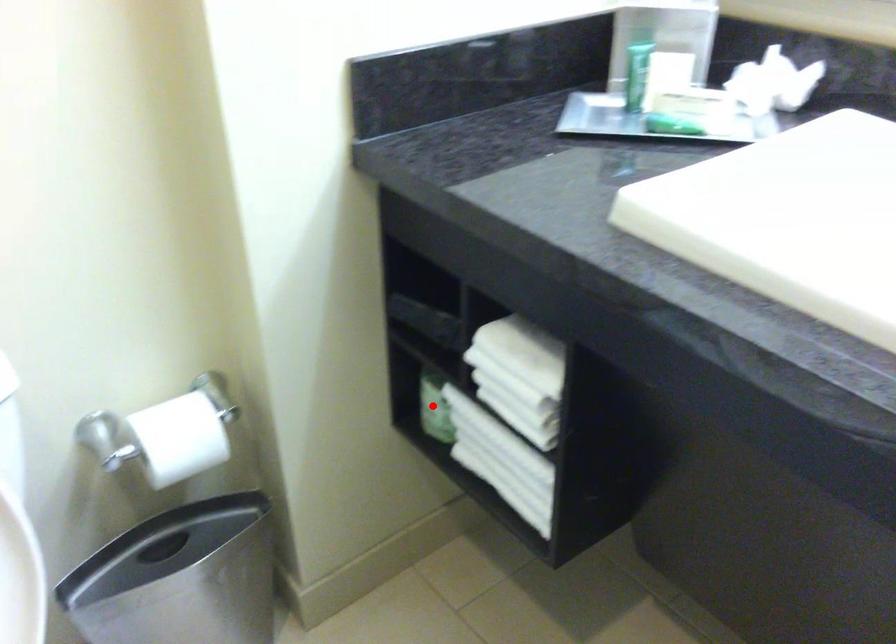
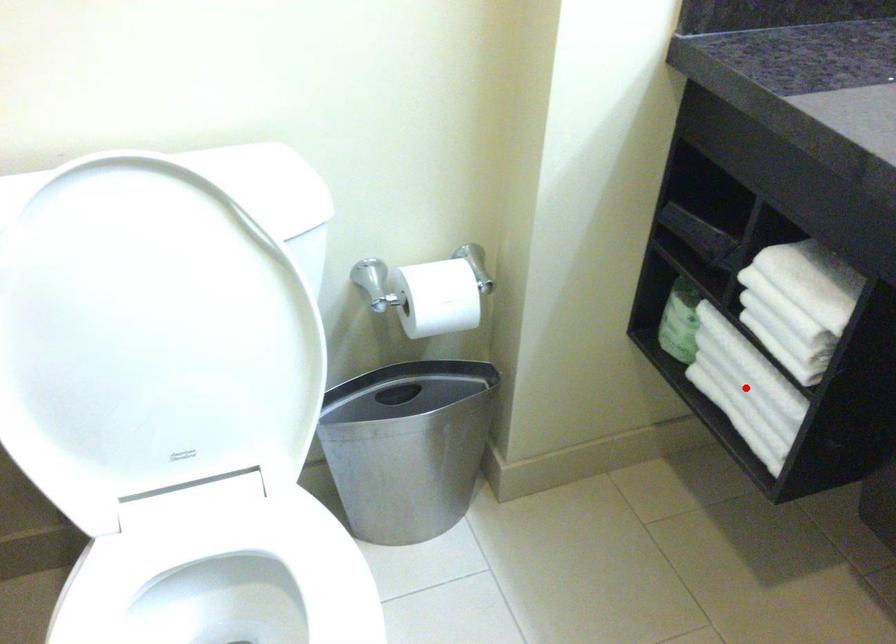
From the picture: I am providing you with two images of the same scene from different viewpoints. A red point is marked on the first image and another point is marked on the second image. Are the points marked in image1 and image2 representing the same 3D position?

No